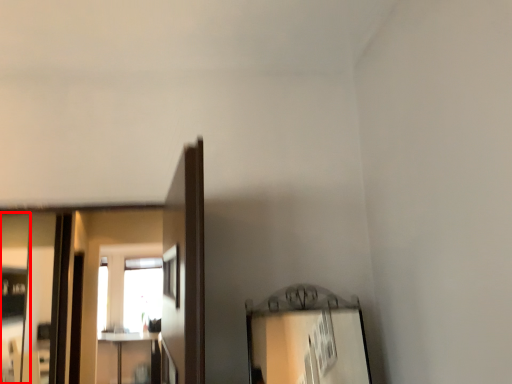
Question: Observing the image, what is the correct spatial positioning of mirror (annotated by the red box) in reference to mirror?

Choices:
 (A) right
 (B) left

Answer: (A)